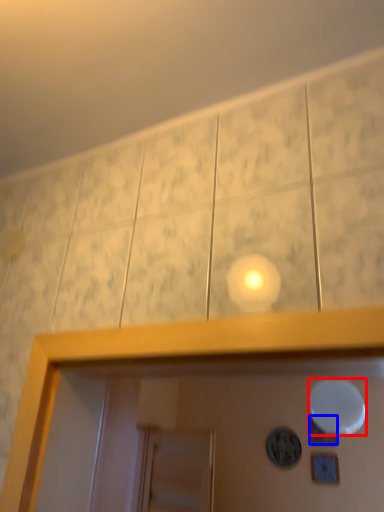
Question: Which of the following is the closest to the observer, mirror (highlighted by a red box) or dot (highlighted by a blue box)?

Choices:
 (A) mirror
 (B) dot

Answer: (A)